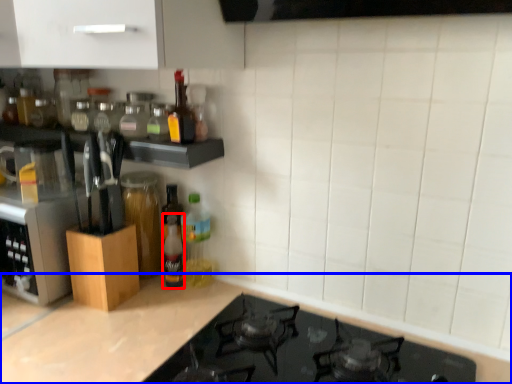
Question: Which object appears closest to the camera in this image, bottle (highlighted by a red box) or countertop (highlighted by a blue box)?

Choices:
 (A) bottle
 (B) countertop

Answer: (B)